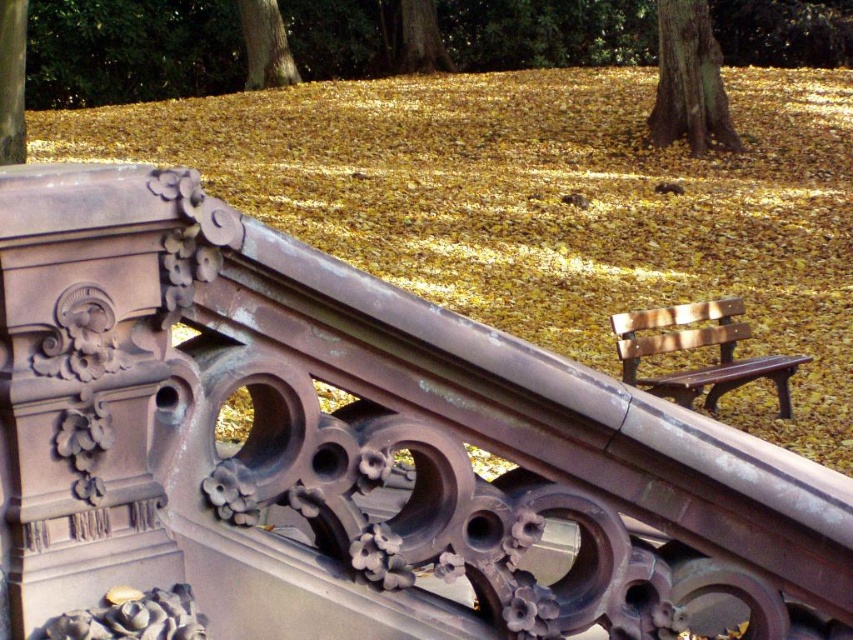
Question: Can you confirm if smooth brown tree trunk at upper left is thinner than smooth brown bark at upper center?

Choices:
 (A) yes
 (B) no

Answer: (A)

Question: Does wooden bench at center appear on the right side of smooth brown tree trunk at upper left?

Choices:
 (A) no
 (B) yes

Answer: (B)

Question: Which point is farther to the camera?

Choices:
 (A) (3, 113)
 (B) (723, 131)
 (C) (668, 388)
 (D) (248, 54)

Answer: (D)

Question: Does wooden bench at center appear over smooth brown bark at upper right?

Choices:
 (A) no
 (B) yes

Answer: (A)

Question: Which of the following is the farthest from the observer?

Choices:
 (A) smooth brown bark at upper right
 (B) smooth brown bark at upper center

Answer: (B)

Question: Among these objects, which one is nearest to the camera?

Choices:
 (A) wooden bench at center
 (B) smooth brown bark at upper right
 (C) smooth brown tree trunk at upper left
 (D) smooth brown bark at upper center

Answer: (A)